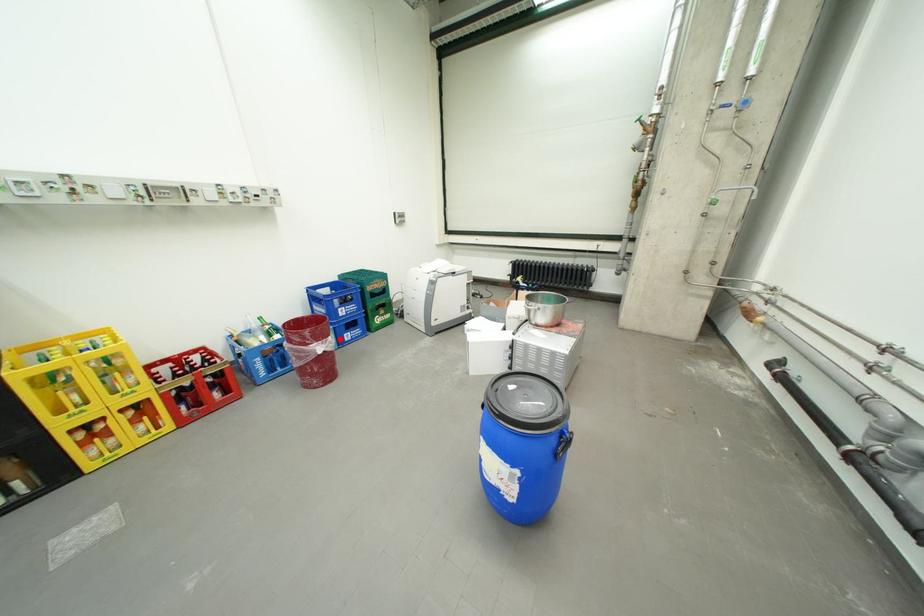
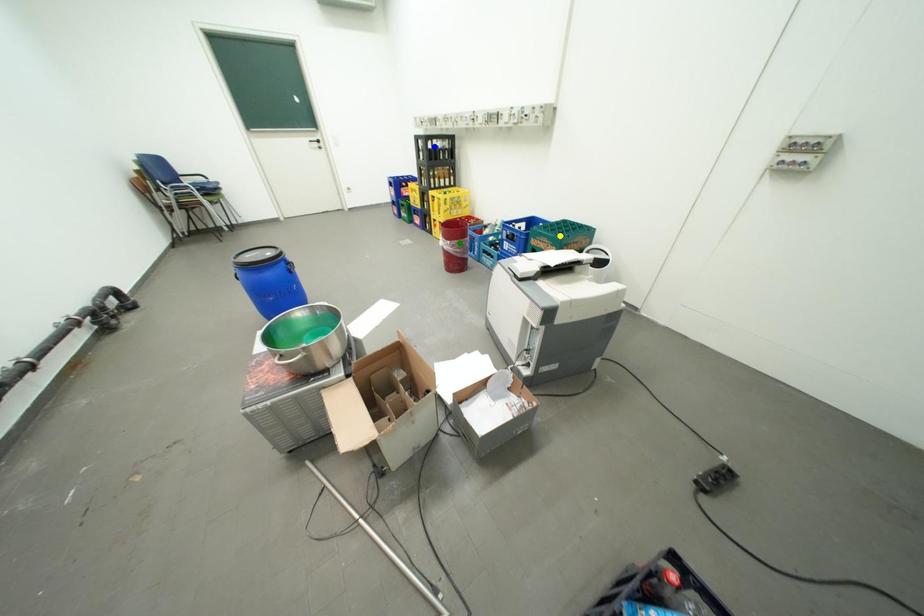
Question: I am providing you with two images of the same scene from different viewpoints. A red point is marked on the first image. You are given multiple points on the second image. In image 2, which mark is for the same physical point as the one in image 1?

Choices:
 (A) yellow point
 (B) blue point
 (C) green point

Answer: (C)